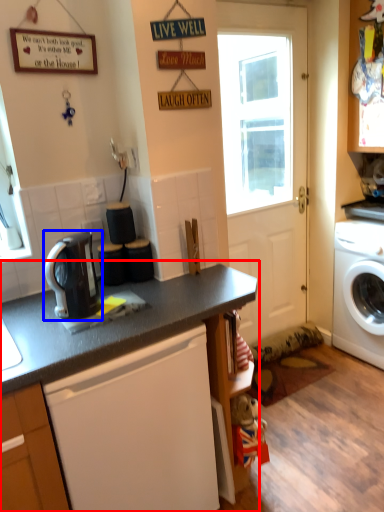
Question: Which of the following is the closest to the observer, countertop (highlighted by a red box) or kitchen appliance (highlighted by a blue box)?

Choices:
 (A) countertop
 (B) kitchen appliance

Answer: (A)